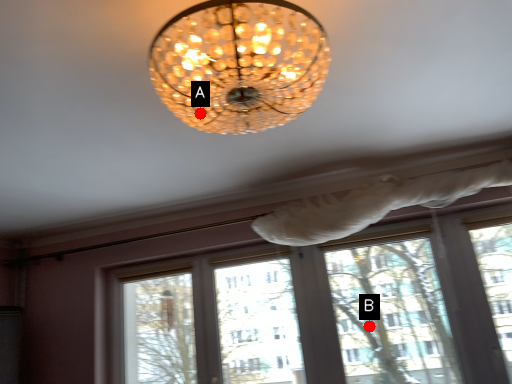
Question: Two points are circled on the image, labeled by A and B beside each circle. Among these points, which one is nearest to the camera?

Choices:
 (A) A is closer
 (B) B is closer

Answer: (A)